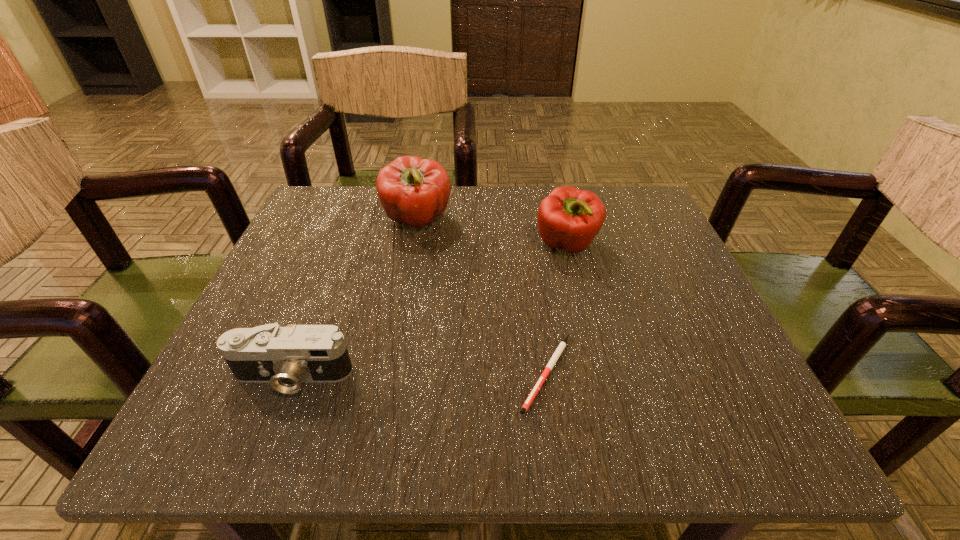
You are a GUI agent. You are given a task and a screenshot of the screen. Output one action in this format:
    pyautogui.click(x=<x>, y=<y>)
    Task: Click on the object at the left edge
    Image resolution: width=960 pixels, height=540 pixels.
    Given the screenshot: What is the action you would take?
    pyautogui.click(x=285, y=357)

You are a GUI agent. You are given a task and a screenshot of the screen. Output one action in this format:
    pyautogui.click(x=<x>, y=<y>)
    Task: Click on the object present at the right edge
    
    Given the screenshot: What is the action you would take?
    pyautogui.click(x=568, y=218)

At what (x,y) coordinates should I click in order to perform the action: click on object at the near left corner. Please return your answer as a coordinate pair (x, y). The width and height of the screenshot is (960, 540). Looking at the image, I should click on (285, 357).

The width and height of the screenshot is (960, 540). I want to click on object present at the far right corner, so click(568, 218).

The width and height of the screenshot is (960, 540). I want to click on vacant space at the far edge of the desktop, so click(x=448, y=217).

Locate an element on the screen. vacant space at the near edge of the desktop is located at coordinates (596, 400).

Identify the location of vacant space at the left edge. (283, 289).

Locate an element on the screen. free location at the right edge of the desktop is located at coordinates (667, 343).

In the image, there is a desktop. At what (x,y) coordinates should I click in order to perform the action: click on free space at the far left corner. Please return your answer as a coordinate pair (x, y). Looking at the image, I should click on (352, 225).

At what (x,y) coordinates should I click in order to perform the action: click on vacant space at the near left corner of the desktop. Please return your answer as a coordinate pair (x, y). The image size is (960, 540). Looking at the image, I should click on (274, 399).